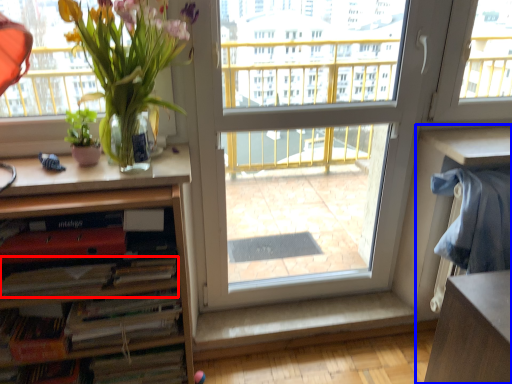
Question: Which of the following is the farthest to the observer, book (highlighted by a red box) or computer desk (highlighted by a blue box)?

Choices:
 (A) book
 (B) computer desk

Answer: (B)